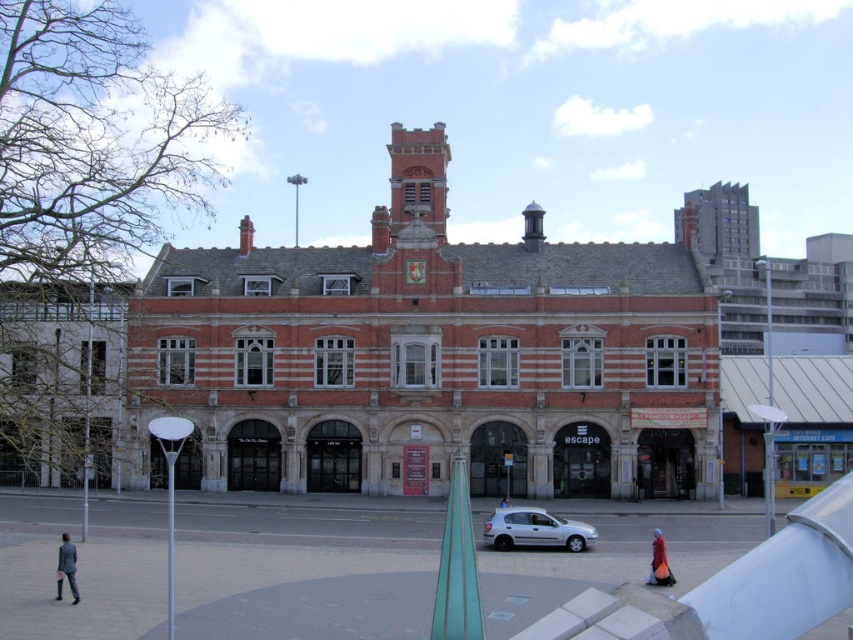
Is silver metallic car at lower center to the right of dark gray suit at lower left from the viewer's perspective?

Correct, you'll find silver metallic car at lower center to the right of dark gray suit at lower left.

Who is more forward, (x=514, y=522) or (x=67, y=547)?

Point (x=67, y=547) is more forward.

Find the location of a particular element. Image resolution: width=853 pixels, height=640 pixels. silver metallic car at lower center is located at coordinates (535, 529).

Does point (68, 557) lie in front of point (674, 580)?

Yes, it is in front of point (674, 580).

Which is behind, point (70, 586) or point (660, 563)?

Point (660, 563)

Is point (73, 552) positioned after point (646, 582)?

No, (73, 552) is closer to viewer.

Where is `dark gray suit at lower left`? dark gray suit at lower left is located at coordinates (67, 566).

Looking at this image, between silver metallic car at lower center and red velvet dress at lower right, which one has more height?

silver metallic car at lower center

Is silver metallic car at lower center shorter than red velvet dress at lower right?

No.

Identify the location of silver metallic car at lower center. (535, 529).